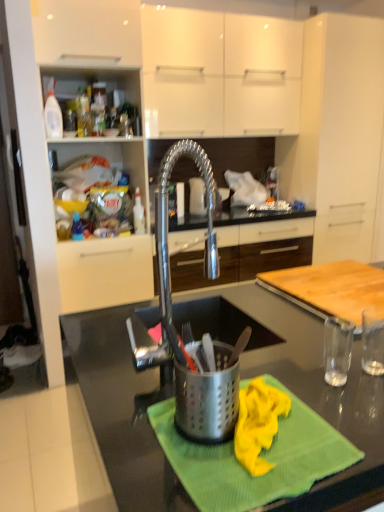
This screenshot has height=512, width=384. I want to click on free point above green textured cloth at center (from a real-world perspective), so click(x=240, y=418).